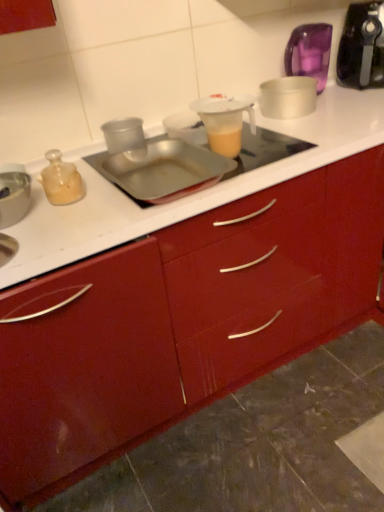
Question: Is glossy red cabinet at center to the right of transparent plastic cup at center, acting as the third appliance starting from the back, from the viewer's perspective?

Choices:
 (A) no
 (B) yes

Answer: (B)

Question: Is glossy red cabinet at center completely or partially outside of transparent plastic cup at center, the second appliance when ordered from left to right?

Choices:
 (A) no
 (B) yes

Answer: (B)

Question: From the image's perspective, is glossy red cabinet at center above transparent plastic cup at center, acting as the third appliance starting from the back?

Choices:
 (A) no
 (B) yes

Answer: (A)

Question: Is glossy red cabinet at center oriented towards transparent plastic cup at center, the second appliance when ordered from left to right?

Choices:
 (A) no
 (B) yes

Answer: (A)

Question: Considering the relative sizes of glossy red cabinet at center and transparent plastic cup at center, the second appliance when ordered from left to right, in the image provided, is glossy red cabinet at center wider than transparent plastic cup at center, the second appliance when ordered from left to right,?

Choices:
 (A) no
 (B) yes

Answer: (B)

Question: Is translucent plastic pitcher at center to the left or to the right of glossy red cabinet at center in the image?

Choices:
 (A) left
 (B) right

Answer: (A)

Question: From their relative heights in the image, would you say translucent plastic pitcher at center is taller or shorter than glossy red cabinet at center?

Choices:
 (A) tall
 (B) short

Answer: (B)

Question: Is point (211, 139) positioned closer to the camera than point (339, 237)?

Choices:
 (A) farther
 (B) closer

Answer: (B)

Question: Is translucent plastic pitcher at center in front of or behind glossy red cabinet at center in the image?

Choices:
 (A) behind
 (B) front

Answer: (A)

Question: From the image's perspective, is white plastic container at upper right, which ranks as the third appliance in front-to-back order, above or below translucent plastic pitcher at center?

Choices:
 (A) below
 (B) above

Answer: (B)

Question: Considering the positions of point (307, 110) and point (236, 153), is point (307, 110) closer or farther from the camera than point (236, 153)?

Choices:
 (A) farther
 (B) closer

Answer: (A)

Question: In the image, is white plastic container at upper right, which ranks as the third appliance in front-to-back order, positioned in front of or behind translucent plastic pitcher at center?

Choices:
 (A) behind
 (B) front

Answer: (A)

Question: Based on their sizes in the image, would you say white plastic container at upper right, which ranks as the third appliance in front-to-back order, is bigger or smaller than translucent plastic pitcher at center?

Choices:
 (A) small
 (B) big

Answer: (B)

Question: From a real-world perspective, is translucent plastic pitcher at center physically located above or below metallic silver bowl at left, marked as the 4th appliance in a right-to-left arrangement?

Choices:
 (A) below
 (B) above

Answer: (B)

Question: Choose the correct answer: Is translucent plastic pitcher at center inside metallic silver bowl at left, which is the 1th appliance in left-to-right order, or outside it?

Choices:
 (A) outside
 (B) inside

Answer: (A)